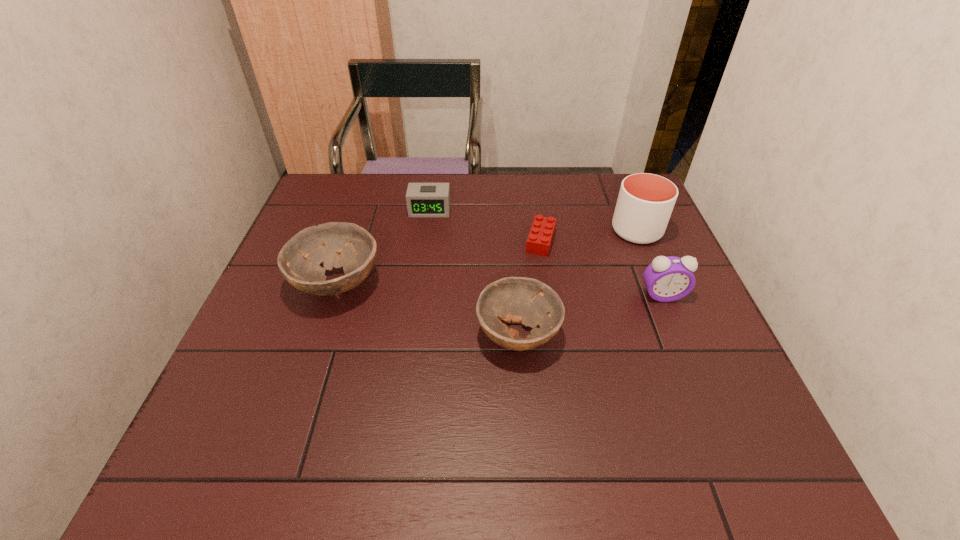
The height and width of the screenshot is (540, 960). In order to click on alarm clock situated at the right edge in this screenshot , I will do `click(667, 279)`.

The width and height of the screenshot is (960, 540). In order to click on object present at the far right corner in this screenshot , I will do `click(645, 202)`.

Locate an element on the screen. The image size is (960, 540). vacant position at the far edge of the desktop is located at coordinates (579, 186).

In the image, there is a desktop. Find the location of `vacant area at the near edge`. vacant area at the near edge is located at coordinates (555, 403).

The image size is (960, 540). I want to click on vacant space at the left edge of the desktop, so click(x=255, y=348).

The image size is (960, 540). What are the coordinates of `vacant area at the far left corner` in the screenshot? It's located at (348, 211).

This screenshot has height=540, width=960. I want to click on vacant space at the far right corner, so (613, 187).

Where is `unoccupied area between the taller bowl and the shortest object`? This screenshot has height=540, width=960. unoccupied area between the taller bowl and the shortest object is located at coordinates (439, 262).

Locate an element on the screen. This screenshot has width=960, height=540. free spot between the nearer alarm clock and the Lego is located at coordinates (602, 268).

Identify the location of free space between the farther alarm clock and the right bowl. Image resolution: width=960 pixels, height=540 pixels. (474, 272).